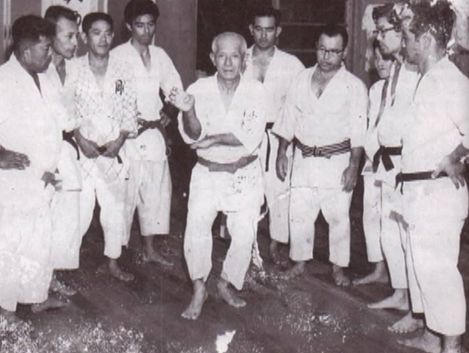
The image size is (469, 353). Find the location of `shelves`. shelves is located at coordinates (313, 23).